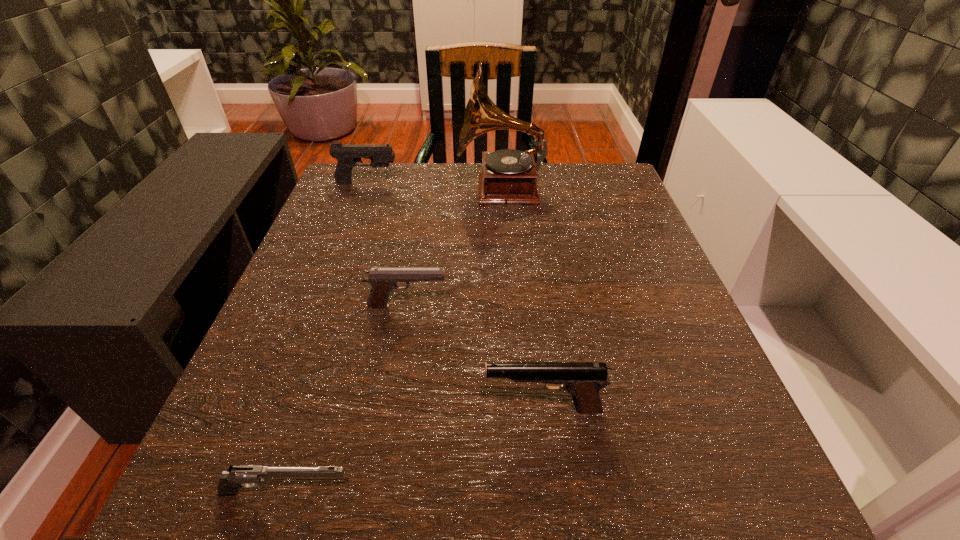
Select which pistol is the second closest to the shortest object. Please provide its 2D coordinates. Your answer should be formatted as a tuple, i.e. [(x, y)], where the tuple contains the x and y coordinates of a point satisfying the conditions above.

[(383, 280)]